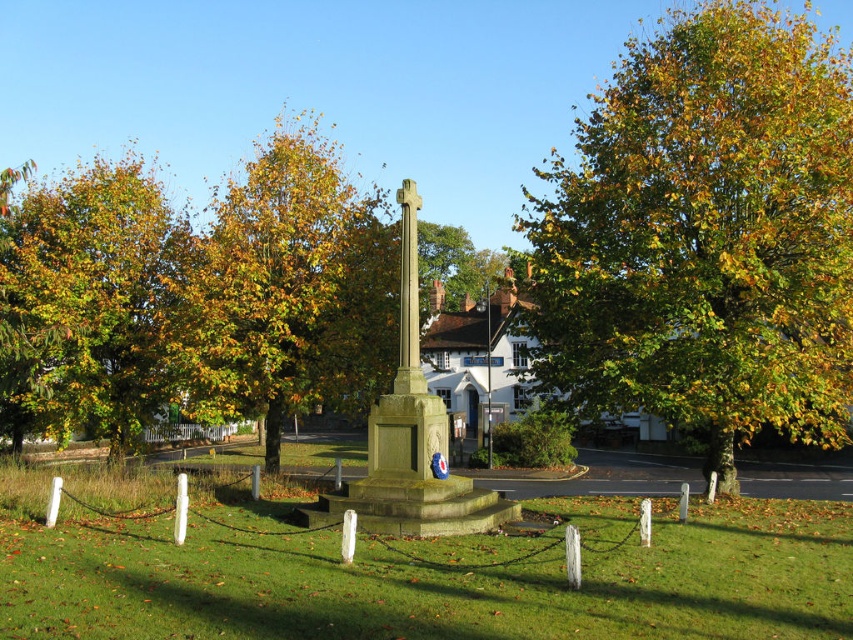
Consider the image. You are standing in front of the war memorial and want to take a photo of the granite cross at center without any obstructions. Since the golden leafy tree at left is in the way, can you move to the right side to get a clear view? Explain why or why not based on their positions.

The granite cross at center is behind the golden leafy tree at left, so moving to the right side might still leave the tree between you and the cross. To get an unobstructed view, you would need to position yourself where the tree does not block the cross, possibly further back or to the opposite side.